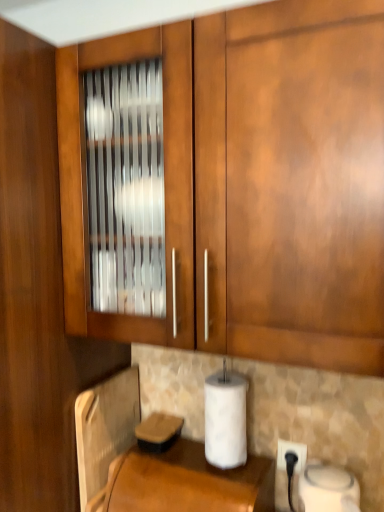
Question: Is metallic silver toaster at lower left a part of white matte paper towel at lower center?

Choices:
 (A) yes
 (B) no

Answer: (B)

Question: Considering the relative sizes of white matte paper towel at lower center and metallic silver toaster at lower left in the image provided, is white matte paper towel at lower center smaller than metallic silver toaster at lower left?

Choices:
 (A) yes
 (B) no

Answer: (B)

Question: Does white matte paper towel at lower center lie in front of metallic silver toaster at lower left?

Choices:
 (A) no
 (B) yes

Answer: (B)

Question: Does white matte paper towel at lower center have a larger size compared to metallic silver toaster at lower left?

Choices:
 (A) yes
 (B) no

Answer: (A)

Question: Are white matte paper towel at lower center and metallic silver toaster at lower left far apart?

Choices:
 (A) yes
 (B) no

Answer: (B)

Question: Would you say white plastic electric outlet at lower right is inside or outside metallic silver toaster at lower left?

Choices:
 (A) outside
 (B) inside

Answer: (A)

Question: Is white plastic electric outlet at lower right in front of or behind metallic silver toaster at lower left in the image?

Choices:
 (A) front
 (B) behind

Answer: (B)

Question: In terms of size, does white plastic electric outlet at lower right appear bigger or smaller than metallic silver toaster at lower left?

Choices:
 (A) big
 (B) small

Answer: (B)

Question: From a real-world perspective, is white plastic electric outlet at lower right physically located above or below metallic silver toaster at lower left?

Choices:
 (A) above
 (B) below

Answer: (B)

Question: Is metallic silver toaster at lower left taller or shorter than white plastic electric outlet at lower right?

Choices:
 (A) short
 (B) tall

Answer: (B)

Question: Would you say metallic silver toaster at lower left is to the left or to the right of white plastic electric outlet at lower right in the picture?

Choices:
 (A) right
 (B) left

Answer: (B)

Question: Looking at the image, does metallic silver toaster at lower left seem bigger or smaller compared to white plastic electric outlet at lower right?

Choices:
 (A) big
 (B) small

Answer: (A)

Question: Is metallic silver toaster at lower left wider or thinner than white plastic electric outlet at lower right?

Choices:
 (A) thin
 (B) wide

Answer: (B)

Question: Which is correct: brown leather at lower center is inside white plastic electric outlet at lower right, or outside of it?

Choices:
 (A) outside
 (B) inside

Answer: (A)

Question: From the image's perspective, is brown leather at lower center positioned above or below white plastic electric outlet at lower right?

Choices:
 (A) above
 (B) below

Answer: (B)